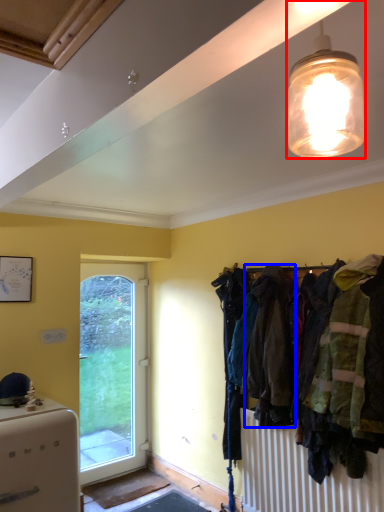
Question: Which point is further to the camera, lamp (highlighted by a red box) or clothing (highlighted by a blue box)?

Choices:
 (A) lamp
 (B) clothing

Answer: (B)